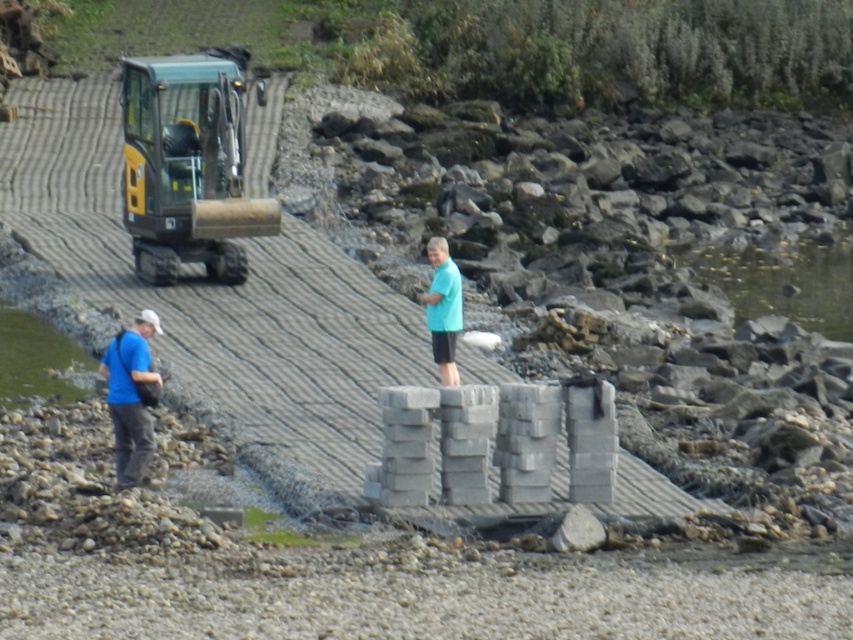
Question: Observing the image, what is the correct spatial positioning of yellow-green metallic excavator at upper left in reference to blue fabric bag at lower left?

Choices:
 (A) below
 (B) above

Answer: (B)

Question: Is yellow-green metallic excavator at upper left above blue fabric bag at lower left?

Choices:
 (A) no
 (B) yes

Answer: (B)

Question: Which point is closer to the camera?

Choices:
 (A) (193, 145)
 (B) (140, 448)

Answer: (B)

Question: Which of the following is the farthest from the observer?

Choices:
 (A) (122, 358)
 (B) (175, 65)

Answer: (B)

Question: Can you confirm if yellow-green metallic excavator at upper left is positioned to the left of blue fabric bag at lower left?

Choices:
 (A) no
 (B) yes

Answer: (B)

Question: Which point is farther to the camera?

Choices:
 (A) yellow-green metallic excavator at upper left
 (B) blue fabric bag at lower left

Answer: (A)